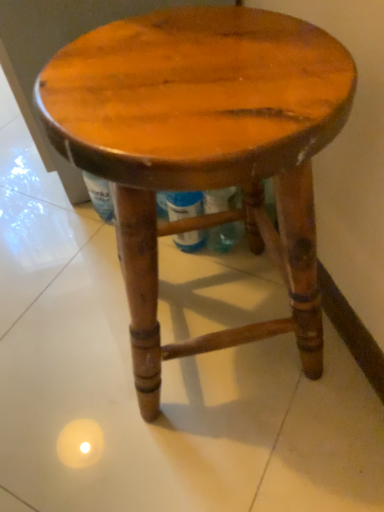
This screenshot has width=384, height=512. What are the coordinates of `vacant area to the left of wooden stool at center` in the screenshot? It's located at (64, 339).